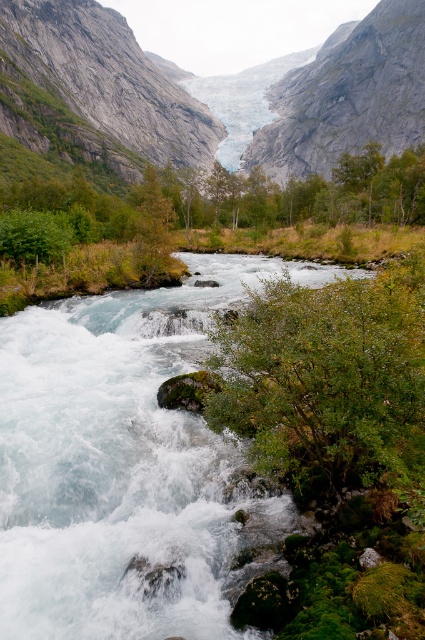
Question: From the image, what is the correct spatial relationship of gray rock mountain at center in relation to green leafy bush at lower center?

Choices:
 (A) below
 (B) above

Answer: (B)

Question: In this image, where is gray rock mountain at center located relative to green leafy bush at lower center?

Choices:
 (A) left
 (B) right

Answer: (B)

Question: Does gray rock mountain at center have a greater width compared to green leafy bush at lower center?

Choices:
 (A) no
 (B) yes

Answer: (B)

Question: Which point appears closest to the camera in this image?

Choices:
 (A) (232, 378)
 (B) (289, 150)

Answer: (A)